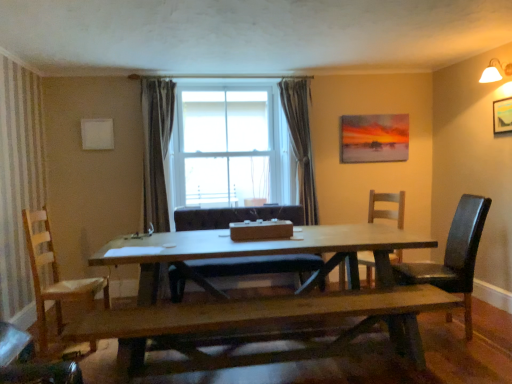
Question: Does black leather chair at right, which is the 1th chair from right to left, lie behind matte acrylic painting at upper right, which appears as the 2th picture frame when viewed from the right?

Choices:
 (A) no
 (B) yes

Answer: (A)

Question: Is black leather chair at right, which is the 1th chair from right to left, not within matte acrylic painting at upper right, the 1th picture frame from the back?

Choices:
 (A) yes
 (B) no

Answer: (A)

Question: Is matte acrylic painting at upper right, acting as the second picture frame starting from the front, surrounded by black leather chair at right, which is the 1th chair from right to left?

Choices:
 (A) yes
 (B) no

Answer: (B)

Question: Does black leather chair at right, the 4th chair in the left-to-right sequence, have a lesser height compared to matte acrylic painting at upper right, acting as the second picture frame starting from the front?

Choices:
 (A) no
 (B) yes

Answer: (A)

Question: Is black leather chair at right, the 4th chair in the left-to-right sequence, oriented away from matte acrylic painting at upper right, acting as the second picture frame starting from the front?

Choices:
 (A) no
 (B) yes

Answer: (A)

Question: Based on their sizes in the image, would you say wooden bench at center is bigger or smaller than white glass window at center?

Choices:
 (A) big
 (B) small

Answer: (B)

Question: From a real-world perspective, relative to white glass window at center, is wooden bench at center vertically above or below?

Choices:
 (A) above
 (B) below

Answer: (B)

Question: In terms of height, does wooden bench at center look taller or shorter compared to white glass window at center?

Choices:
 (A) tall
 (B) short

Answer: (B)

Question: From the image's perspective, relative to white glass window at center, is wooden bench at center above or below?

Choices:
 (A) above
 (B) below

Answer: (B)

Question: Considering the positions of white fabric lampshade at upper right and wooden bench at center in the image, is white fabric lampshade at upper right wider or thinner than wooden bench at center?

Choices:
 (A) thin
 (B) wide

Answer: (A)

Question: From the image's perspective, is white fabric lampshade at upper right located above or below wooden bench at center?

Choices:
 (A) below
 (B) above

Answer: (B)

Question: Considering the positions of white fabric lampshade at upper right and wooden bench at center in the image, is white fabric lampshade at upper right taller or shorter than wooden bench at center?

Choices:
 (A) short
 (B) tall

Answer: (A)

Question: From a real-world perspective, is white fabric lampshade at upper right physically located above or below wooden bench at center?

Choices:
 (A) above
 (B) below

Answer: (A)

Question: In terms of height, does light brown wooden chair at left, the 4th chair positioned from the right, look taller or shorter compared to wooden chair at right, the 3th chair when ordered from left to right?

Choices:
 (A) tall
 (B) short

Answer: (A)

Question: Considering the positions of light brown wooden chair at left, the 4th chair positioned from the right, and wooden chair at right, the 3th chair when ordered from left to right, in the image, is light brown wooden chair at left, the 4th chair positioned from the right, wider or thinner than wooden chair at right, the 3th chair when ordered from left to right,?

Choices:
 (A) thin
 (B) wide

Answer: (A)